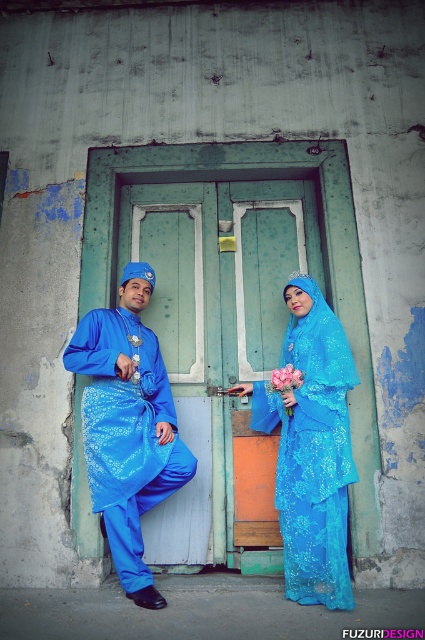
Which of these two, green wooden door at center or matte blue kurta at center, stands taller?

green wooden door at center is taller.

Does green wooden door at center have a lesser width compared to matte blue kurta at center?

No, green wooden door at center is not thinner than matte blue kurta at center.

Is point (334, 205) positioned behind point (76, 355)?

Yes.

The width and height of the screenshot is (425, 640). I want to click on green wooden door at center, so click(322, 256).

Which is in front, point (342, 188) or point (280, 374)?

Point (280, 374) is more forward.

Where is `green wooden door at center`? green wooden door at center is located at coordinates (322, 256).

Locate an element on the screen. This screenshot has width=425, height=640. green wooden door at center is located at coordinates (322, 256).

Is point (353, 508) less distant than point (348, 381)?

No, it is behind (348, 381).

From the picture: Is green wooden door at center in front of shiny blue dress at center?

That is False.

The height and width of the screenshot is (640, 425). Find the location of `green wooden door at center`. green wooden door at center is located at coordinates (322, 256).

Image resolution: width=425 pixels, height=640 pixels. Find the location of `green wooden door at center`. green wooden door at center is located at coordinates (322, 256).